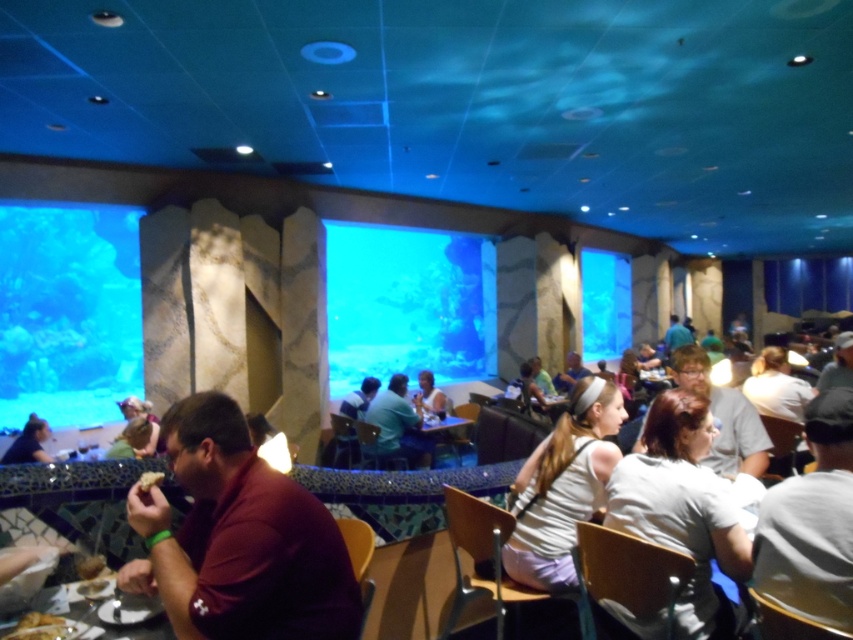
Question: Which object is farther from the camera taking this photo?

Choices:
 (A) wooden table at lower left
 (B) light blue shirt at center

Answer: (B)

Question: Can you confirm if light blue shirt at center is wider than wooden table at lower left?

Choices:
 (A) no
 (B) yes

Answer: (B)

Question: Which of the following is the farthest from the observer?

Choices:
 (A) dark brown leather jacket at lower left
 (B) wooden table at lower left
 (C) gray cotton shirt at lower right

Answer: (A)

Question: Which of the following is the closest to the observer?

Choices:
 (A) light blue shirt at center
 (B) white matte tank top at center
 (C) wooden table at lower left

Answer: (C)

Question: Does maroon shirt at lower left appear over light blue shirt at center?

Choices:
 (A) no
 (B) yes

Answer: (B)

Question: Does wooden table at lower left have a larger size compared to dark brown leather jacket at lower left?

Choices:
 (A) yes
 (B) no

Answer: (B)